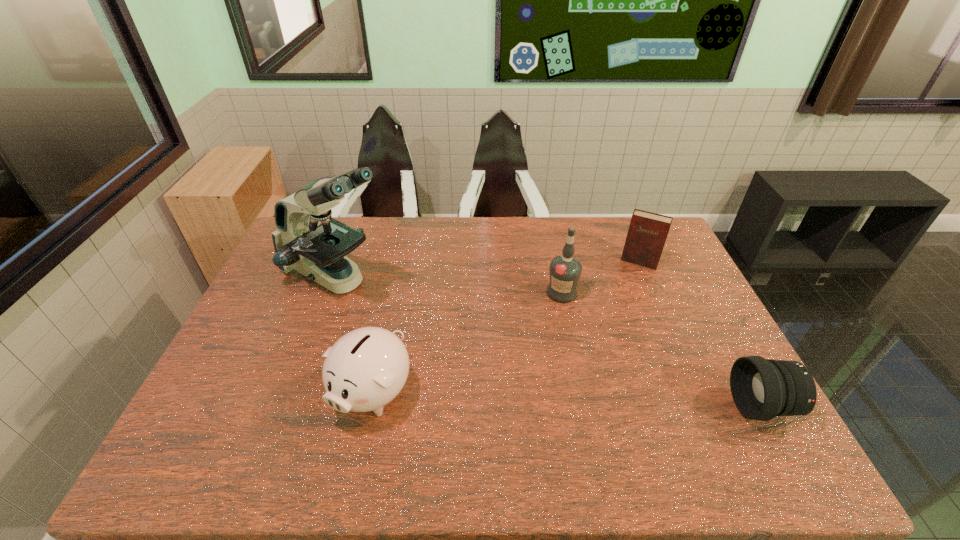
Locate an element on the screen. The image size is (960, 540). diary that is at the far edge is located at coordinates (647, 233).

I want to click on microscope that is at the far edge, so click(x=307, y=239).

Identify the location of piggy bank that is positioned at the near edge. The width and height of the screenshot is (960, 540). click(365, 369).

Locate an element on the screen. The image size is (960, 540). telephoto lens that is at the near edge is located at coordinates (761, 388).

The height and width of the screenshot is (540, 960). I want to click on object that is at the left edge, so click(307, 239).

Where is `telephoto lens situated at the right edge`? telephoto lens situated at the right edge is located at coordinates (761, 388).

Locate an element on the screen. The width and height of the screenshot is (960, 540). diary that is at the right edge is located at coordinates coord(647,233).

You are a GUI agent. You are given a task and a screenshot of the screen. Output one action in this format:
    pyautogui.click(x=<x>, y=<y>)
    Task: Click on the object present at the far left corner
    
    Given the screenshot: What is the action you would take?
    pyautogui.click(x=307, y=239)

This screenshot has height=540, width=960. I want to click on object that is at the far right corner, so click(x=647, y=233).

You are a GUI agent. You are given a task and a screenshot of the screen. Output one action in this format:
    pyautogui.click(x=<x>, y=<y>)
    Task: Click on the object at the near right corner
    The height and width of the screenshot is (540, 960).
    Given the screenshot: What is the action you would take?
    pyautogui.click(x=761, y=388)